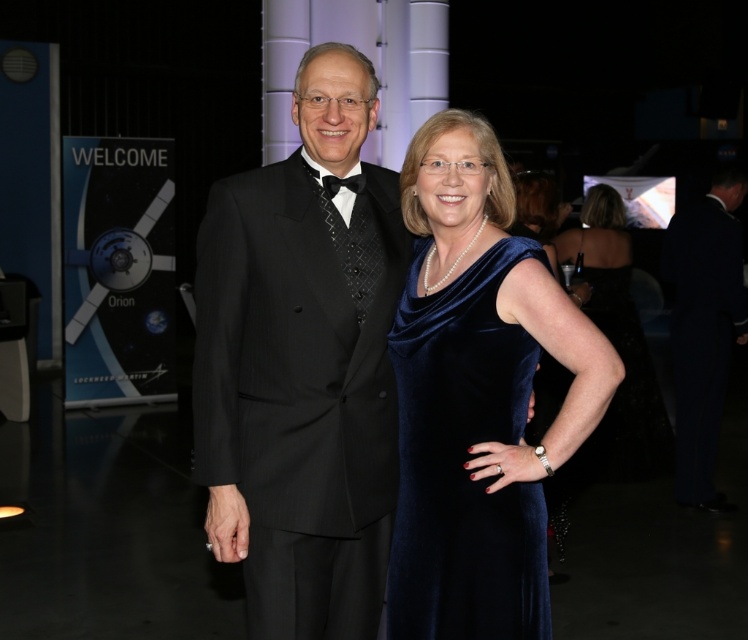
You are organizing a photo shoot and need to arrange two velvet blue dresses in the image. The velvet blue dress at right and the velvet blue dress at center must be positioned so that one is taller than the other. Based on the scene description, which dress should you place higher to match the existing arrangement?

The velvet blue dress at center should be placed higher because the velvet blue dress at right has a lesser height compared to the velvet blue dress at center according to the description.

You are an event planner arranging a photo shoot for the formal event shown. You need to position a spotlight exactly at the location of the velvet blue dress at right. What are the coordinates where you should place the spotlight?

The velvet blue dress at right is located at point (462, 460), so you should place the spotlight at those coordinates to focus on it.

You are a photographer at a formal event. You need to capture a photo where both the black velvet suit at right and the velvet blue dress at center are clearly visible. Based on their positions, which one should you focus on first to ensure both are in focus?

The black velvet suit at right is in front of the velvet blue dress at center, so you should focus on the velvet blue dress at center first to ensure both are in focus.